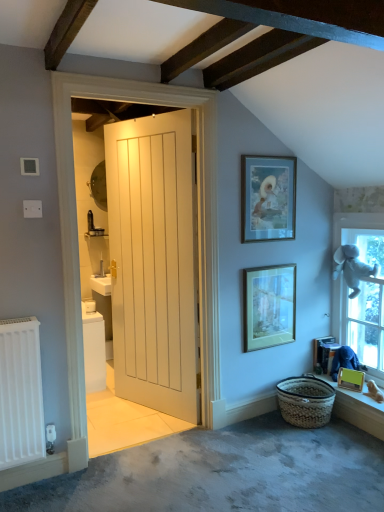
This screenshot has width=384, height=512. What are the coordinates of `free space to the left of white wooden door at center` in the screenshot? It's located at (116, 406).